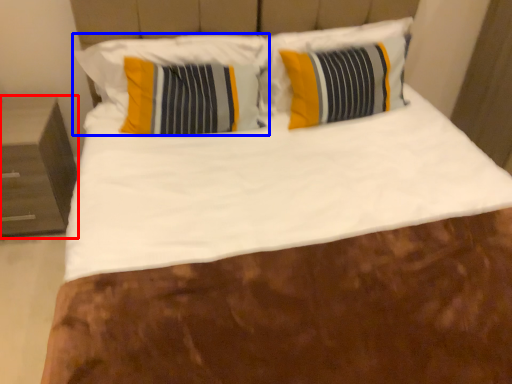
Question: Among these objects, which one is nearest to the camera, nightstand (highlighted by a red box) or pillow (highlighted by a blue box)?

Choices:
 (A) nightstand
 (B) pillow

Answer: (A)